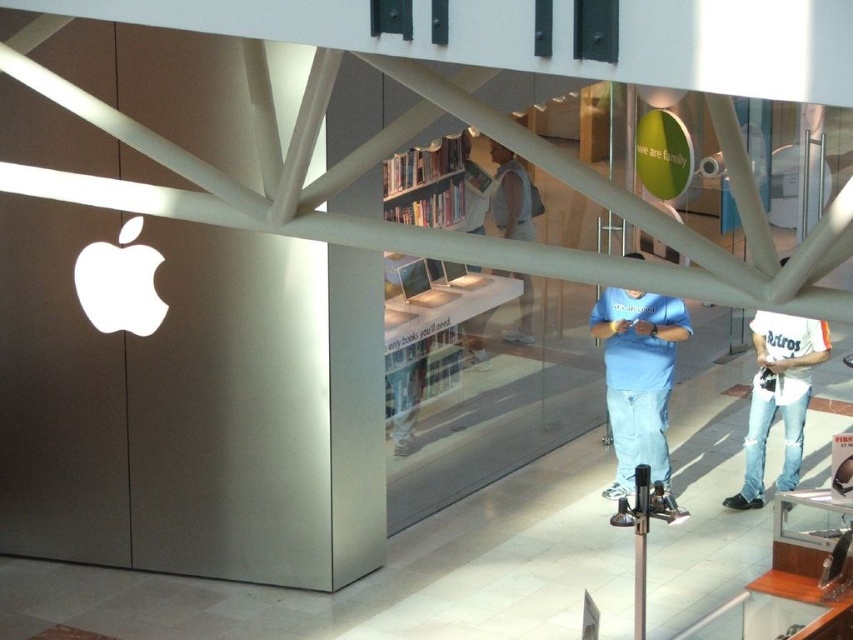
Question: Is light blue t-shirt at center to the left of white cotton shirt at lower right from the viewer's perspective?

Choices:
 (A) no
 (B) yes

Answer: (B)

Question: Does light blue t-shirt at center come in front of white cotton shirt at lower right?

Choices:
 (A) yes
 (B) no

Answer: (A)

Question: Considering the relative positions of light blue t-shirt at center and white cotton shirt at lower right in the image provided, where is light blue t-shirt at center located with respect to white cotton shirt at lower right?

Choices:
 (A) right
 (B) left

Answer: (B)

Question: Among these objects, which one is farthest from the camera?

Choices:
 (A) white cotton shirt at lower right
 (B) light blue t-shirt at center

Answer: (A)